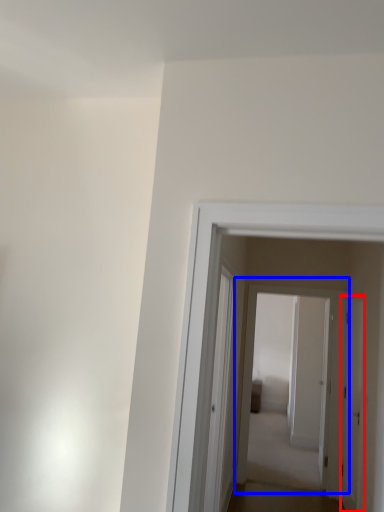
Question: Which object is further to the camera taking this photo, door (highlighted by a red box) or door (highlighted by a blue box)?

Choices:
 (A) door
 (B) door

Answer: (B)